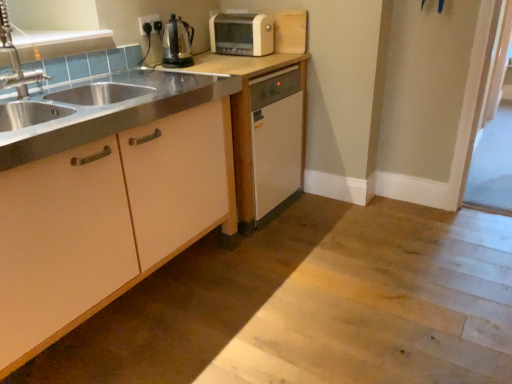
Question: Which is correct: clear glass screen door at right is inside matte white cabinet at left, marked as the second cabinetry in a back-to-front arrangement, or outside of it?

Choices:
 (A) inside
 (B) outside

Answer: (B)

Question: From the image's perspective, is clear glass screen door at right above or below matte white cabinet at left, placed as the 1th cabinetry when sorted from front to back?

Choices:
 (A) above
 (B) below

Answer: (A)

Question: Which object is the farthest from the matte white dishwasher at center, which is the second cabinetry in front-to-back order?

Choices:
 (A) brushed metal faucet at left
 (B) white plastic toaster at upper center
 (C) black plastic electric outlet at upper center
 (D) shiny metallic kettle at upper center
 (E) clear glass screen door at right

Answer: (E)

Question: Which object is the farthest from the matte white dishwasher at center, which is the second cabinetry in front-to-back order?

Choices:
 (A) shiny metallic kettle at upper center
 (B) white plastic toaster at upper center
 (C) clear glass screen door at right
 (D) matte white cabinet at left, marked as the second cabinetry in a back-to-front arrangement
 (E) black plastic electric outlet at upper center

Answer: (C)